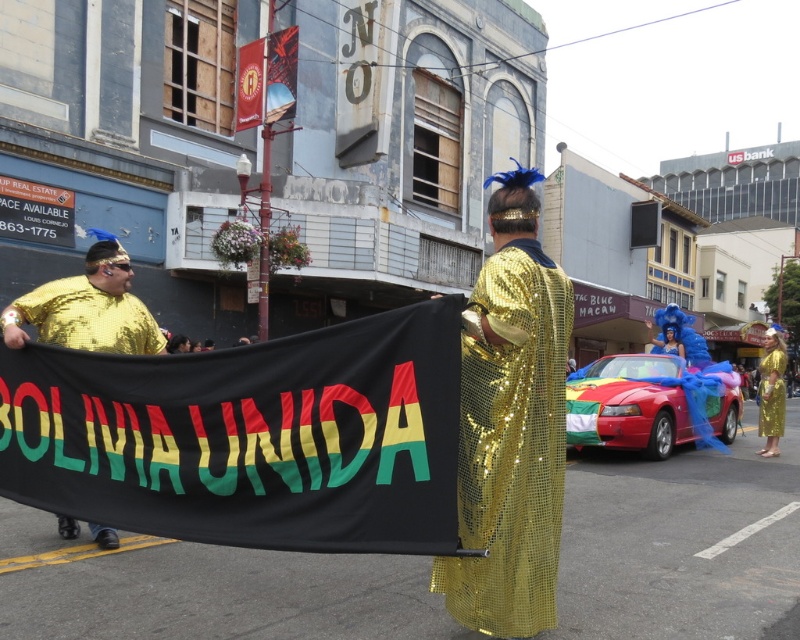
You are a photographer trying to capture a photo of the gold sequined shirt at left and the gold sequined dress at center. Based on their positions, which one is higher in the image?

The gold sequined shirt at left is above the gold sequined dress at center, so it is higher in the image.

You are a photographer at the parade and want to capture both the gold sequined cape at center and the gold sequined shirt at left in a single frame. Since you can adjust the camera zoom, which object should you zoom in on to ensure both fit in the frame without cropping?

The gold sequined cape at center is smaller than the gold sequined shirt at left, so you should zoom in on the larger gold sequined shirt at left to accommodate both objects in the frame.